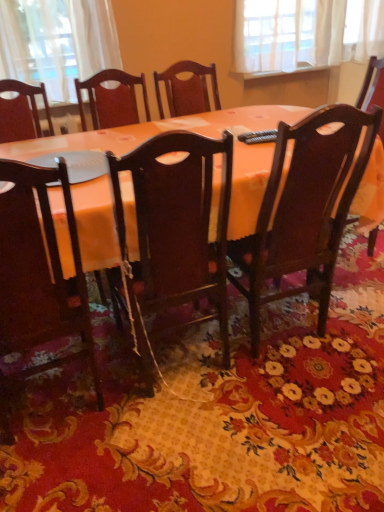
Where is `vacant space in front of polished dark wood chair at center, acting as the 3th chair starting from the left`? vacant space in front of polished dark wood chair at center, acting as the 3th chair starting from the left is located at coordinates (298, 405).